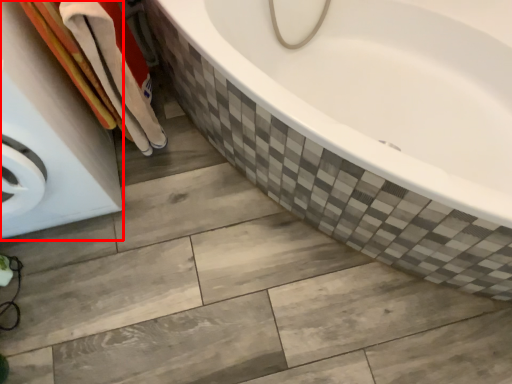
Question: From the image's perspective, what is the correct spatial positioning of washing machine (annotated by the red box) in reference to bath towel?

Choices:
 (A) above
 (B) below

Answer: (B)